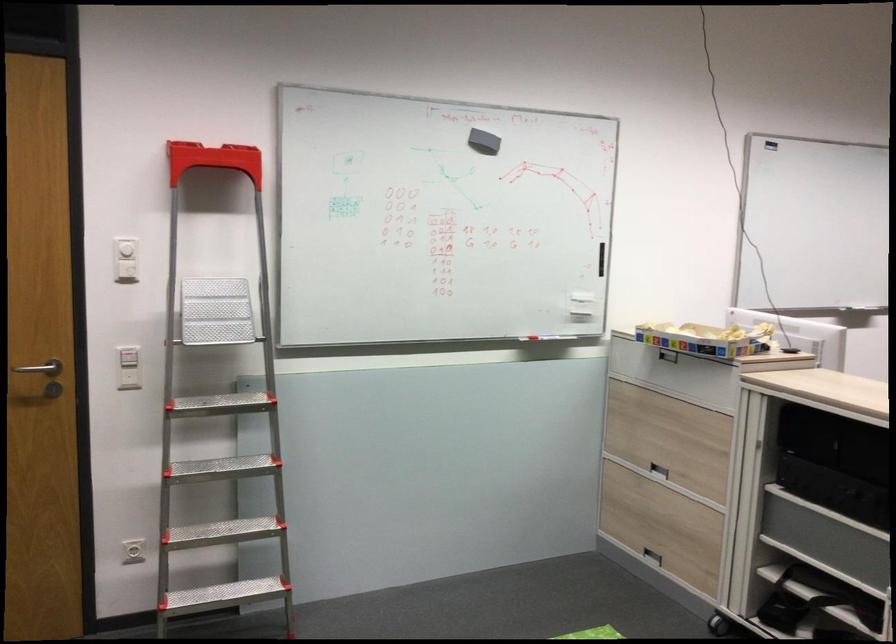
What do you see at coordinates (128, 377) in the screenshot? I see `a white wall button` at bounding box center [128, 377].